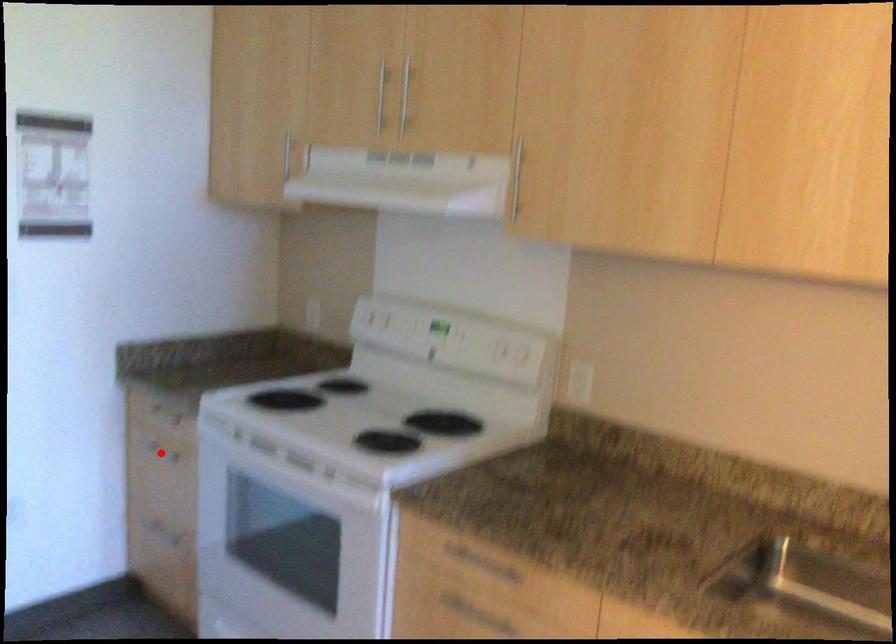
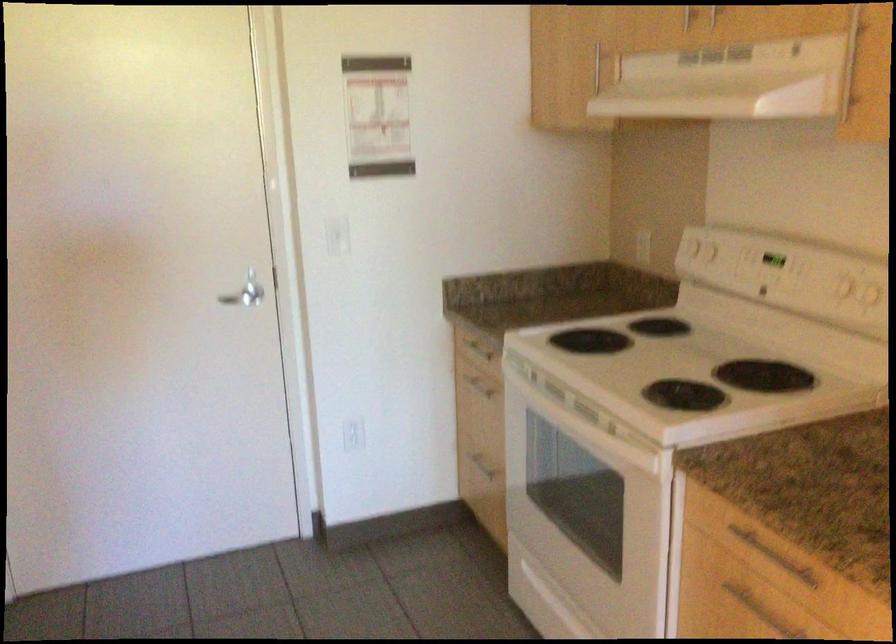
Find the pixel in the second image that matches the highlighted location in the first image.

(479, 384)